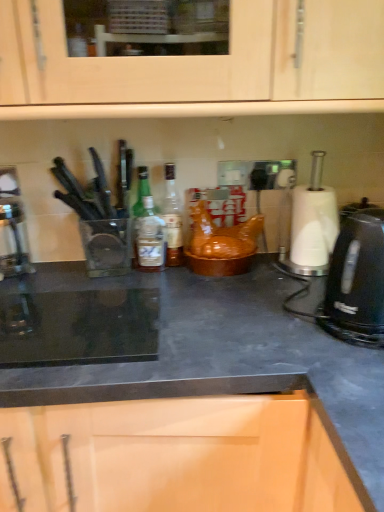
Identify the location of free space that is to the left of black plastic kettle at right. (270, 325).